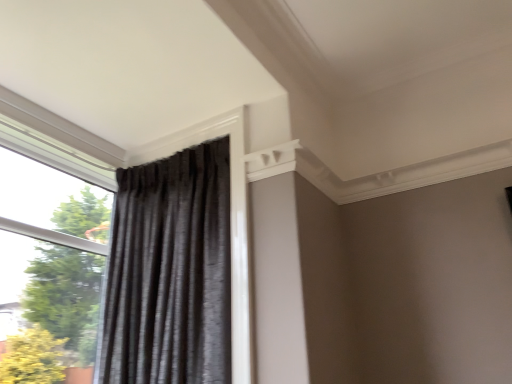
This screenshot has width=512, height=384. I want to click on dark grey textured curtain at center, so click(170, 272).

What do you see at coordinates (170, 272) in the screenshot? I see `dark grey textured curtain at center` at bounding box center [170, 272].

At what (x,y) coordinates should I click in order to perform the action: click on dark grey textured curtain at center. Please return your answer as a coordinate pair (x, y). The width and height of the screenshot is (512, 384). Looking at the image, I should click on (170, 272).